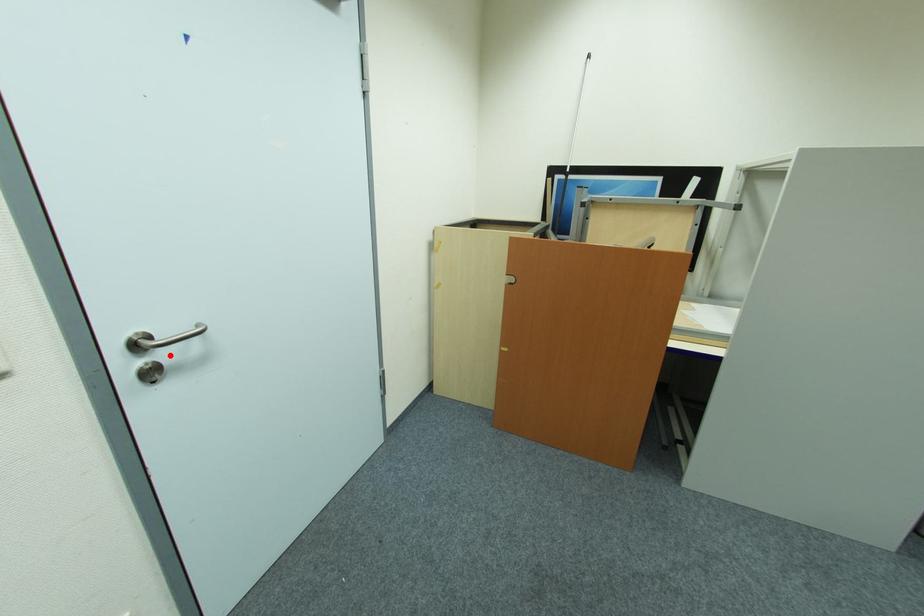
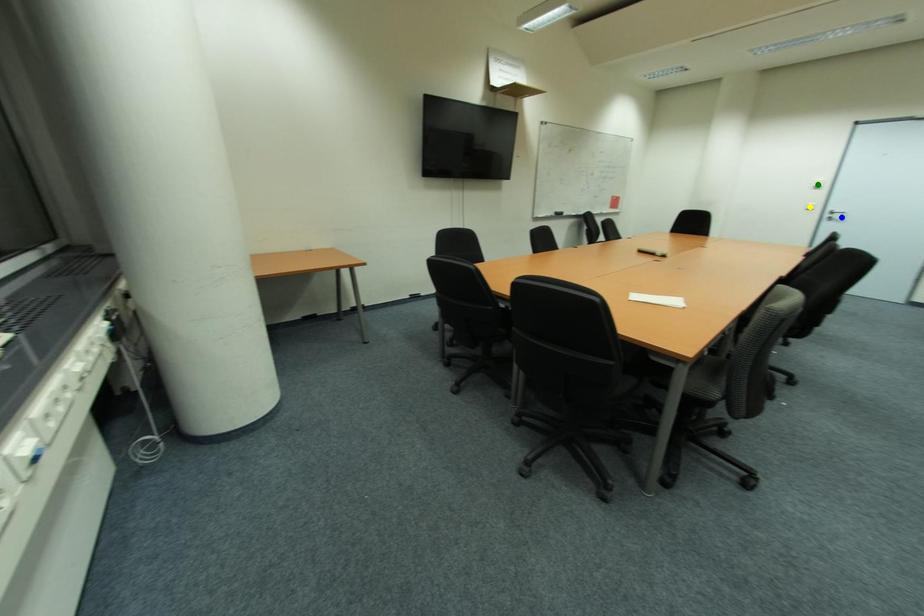
Question: I am providing you with two images of the same scene from different viewpoints. A red point is marked on the first image. You are given multiple points on the second image. Which spot in image 2 lines up with the point in image 1?

Choices:
 (A) green point
 (B) blue point
 (C) yellow point

Answer: (B)